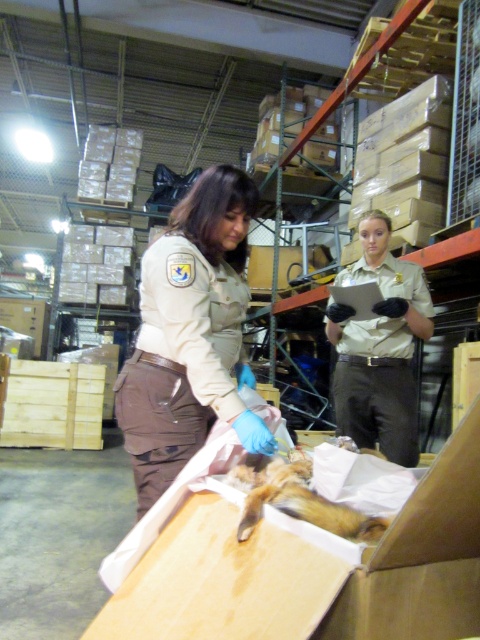
Question: Considering the relative positions of tan uniform at center and furry brown animal at center in the image provided, where is tan uniform at center located with respect to furry brown animal at center?

Choices:
 (A) below
 (B) above

Answer: (B)

Question: Does tan uniform at center have a lesser width compared to furry brown animal at center?

Choices:
 (A) no
 (B) yes

Answer: (A)

Question: Which object appears closest to the camera in this image?

Choices:
 (A) tan uniform at center
 (B) furry brown animal at center

Answer: (B)

Question: Which object is closer to the camera taking this photo?

Choices:
 (A) beige uniform at center
 (B) tan uniform at center
 (C) furry brown animal at center

Answer: (C)

Question: Can you confirm if beige uniform at center is thinner than tan uniform at center?

Choices:
 (A) no
 (B) yes

Answer: (B)

Question: Among these objects, which one is nearest to the camera?

Choices:
 (A) tan uniform at center
 (B) furry brown animal at center

Answer: (B)